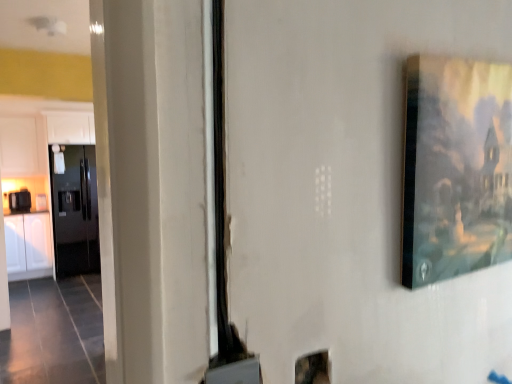
What do you see at coordinates (28, 246) in the screenshot? The image size is (512, 384). I see `white glossy cabinet at left, the 2th cabinetry from the top` at bounding box center [28, 246].

Locate an element on the screen. This screenshot has width=512, height=384. black glossy toaster at left is located at coordinates (20, 201).

What do you see at coordinates (75, 211) in the screenshot? I see `glossy black refrigerator at left` at bounding box center [75, 211].

Locate an element on the screen. This screenshot has width=512, height=384. white matte cabinet at upper left, acting as the second cabinetry starting from the bottom is located at coordinates (22, 145).

From the image's perspective, between matte wooden picture frame at upper right and white matte cabinet at upper left, which ranks as the 1th cabinetry in top-to-bottom order, which one is located above?

white matte cabinet at upper left, which ranks as the 1th cabinetry in top-to-bottom order.

Between matte wooden picture frame at upper right and white matte cabinet at upper left, which ranks as the 1th cabinetry in top-to-bottom order, which one has larger width?

white matte cabinet at upper left, which ranks as the 1th cabinetry in top-to-bottom order.

Is white matte cabinet at upper left, which ranks as the 1th cabinetry in top-to-bottom order, at the back of matte wooden picture frame at upper right?

Yes.

Is matte wooden picture frame at upper right not close to white matte cabinet at upper left, which ranks as the 1th cabinetry in top-to-bottom order?

matte wooden picture frame at upper right is far away from white matte cabinet at upper left, which ranks as the 1th cabinetry in top-to-bottom order.

In terms of height, does white matte cabinet at upper left, acting as the second cabinetry starting from the bottom, look taller or shorter compared to white glossy cabinet at left, the 2th cabinetry from the top?

Considering their sizes, white matte cabinet at upper left, acting as the second cabinetry starting from the bottom, has less height than white glossy cabinet at left, the 2th cabinetry from the top.

Is white matte cabinet at upper left, which ranks as the 1th cabinetry in top-to-bottom order, in front of white glossy cabinet at left, the 2th cabinetry from the top?

No, it is behind white glossy cabinet at left, the 2th cabinetry from the top.

Find the location of a particular element. Image resolution: width=512 pixels, height=384 pixels. cabinetry on the left of white glossy cabinet at left, the 1th cabinetry from the bottom is located at coordinates (22, 145).

Are white matte cabinet at upper left, which ranks as the 1th cabinetry in top-to-bottom order, and white glossy cabinet at left, the 1th cabinetry from the bottom, making contact?

No.

From the image's perspective, is black glossy toaster at left on top of matte wooden picture frame at upper right?

No, from the image's perspective, black glossy toaster at left is not above matte wooden picture frame at upper right.

Between black glossy toaster at left and matte wooden picture frame at upper right, which one has smaller size?

With smaller size is matte wooden picture frame at upper right.

Between black glossy toaster at left and matte wooden picture frame at upper right, which one appears on the left side from the viewer's perspective?

Positioned to the left is black glossy toaster at left.

How different are the orientations of black glossy toaster at left and matte wooden picture frame at upper right in degrees?

The angular difference between black glossy toaster at left and matte wooden picture frame at upper right is 4.31 degrees.

Is white glossy cabinet at left, the 1th cabinetry from the bottom, far away from matte wooden picture frame at upper right?

white glossy cabinet at left, the 1th cabinetry from the bottom, is positioned a significant distance from matte wooden picture frame at upper right.

Considering the relative positions of white glossy cabinet at left, the 2th cabinetry from the top, and matte wooden picture frame at upper right in the image provided, is white glossy cabinet at left, the 2th cabinetry from the top, to the left of matte wooden picture frame at upper right from the viewer's perspective?

Yes, white glossy cabinet at left, the 2th cabinetry from the top, is to the left of matte wooden picture frame at upper right.

Considering the positions of objects white glossy cabinet at left, the 2th cabinetry from the top, and matte wooden picture frame at upper right in the image provided, who is in front, white glossy cabinet at left, the 2th cabinetry from the top, or matte wooden picture frame at upper right?

matte wooden picture frame at upper right is in front.

Considering the points (35, 231) and (466, 123), which point is in front, point (35, 231) or point (466, 123)?

The point (466, 123) is in front.

Is black glossy toaster at left bigger or smaller than glossy black refrigerator at left?

Considering their sizes, black glossy toaster at left takes up less space than glossy black refrigerator at left.

Which object is positioned more to the right, black glossy toaster at left or glossy black refrigerator at left?

Positioned to the right is glossy black refrigerator at left.

Does point (20, 203) come in front of point (67, 241)?

No, it is not.

Which is in front, point (32, 220) or point (17, 210)?

Point (17, 210)

Would you say white glossy cabinet at left, the 2th cabinetry from the top, is outside black glossy toaster at left?

white glossy cabinet at left, the 2th cabinetry from the top, is positioned outside black glossy toaster at left.

Who is shorter, glossy black refrigerator at left or white glossy cabinet at left, the 2th cabinetry from the top?

With less height is white glossy cabinet at left, the 2th cabinetry from the top.

Consider the image. Would you say glossy black refrigerator at left is inside or outside white glossy cabinet at left, the 1th cabinetry from the bottom?

glossy black refrigerator at left lies outside white glossy cabinet at left, the 1th cabinetry from the bottom.

Could you tell me if glossy black refrigerator at left is turned towards white glossy cabinet at left, the 1th cabinetry from the bottom?

No, glossy black refrigerator at left is not oriented towards white glossy cabinet at left, the 1th cabinetry from the bottom.

The height and width of the screenshot is (384, 512). What are the coordinates of `cabinetry positioned vertically above the matte wooden picture frame at upper right (from a real-world perspective)` in the screenshot? It's located at (22, 145).

Locate an element on the screen. This screenshot has width=512, height=384. cabinetry located in front of the white matte cabinet at upper left, which ranks as the 1th cabinetry in top-to-bottom order is located at coordinates (28, 246).

Estimate the real-world distances between objects in this image. Which object is closer to white matte cabinet at upper left, which ranks as the 1th cabinetry in top-to-bottom order, black glossy toaster at left or white glossy cabinet at left, the 1th cabinetry from the bottom?

The object closer to white matte cabinet at upper left, which ranks as the 1th cabinetry in top-to-bottom order, is black glossy toaster at left.

Considering their positions, is white glossy cabinet at left, the 1th cabinetry from the bottom, positioned further to matte wooden picture frame at upper right than white matte cabinet at upper left, acting as the second cabinetry starting from the bottom?

Based on the image, white glossy cabinet at left, the 1th cabinetry from the bottom, appears to be further to matte wooden picture frame at upper right.

Based on their spatial positions, is white glossy cabinet at left, the 2th cabinetry from the top, or white matte cabinet at upper left, acting as the second cabinetry starting from the bottom, further from glossy black refrigerator at left?

white matte cabinet at upper left, acting as the second cabinetry starting from the bottom, lies further to glossy black refrigerator at left than the other object.

Considering their positions, is black glossy toaster at left positioned closer to white glossy cabinet at left, the 2th cabinetry from the top, than white matte cabinet at upper left, acting as the second cabinetry starting from the bottom?

black glossy toaster at left.

Which object lies nearer to the anchor point matte wooden picture frame at upper right, white matte cabinet at upper left, which ranks as the 1th cabinetry in top-to-bottom order, or black glossy toaster at left?

The object closer to matte wooden picture frame at upper right is white matte cabinet at upper left, which ranks as the 1th cabinetry in top-to-bottom order.

When comparing their distances from glossy black refrigerator at left, does white glossy cabinet at left, the 2th cabinetry from the top, or black glossy toaster at left seem further?

Based on the image, black glossy toaster at left appears to be further to glossy black refrigerator at left.

From the image, which object appears to be farther from white matte cabinet at upper left, which ranks as the 1th cabinetry in top-to-bottom order, matte wooden picture frame at upper right or glossy black refrigerator at left?

matte wooden picture frame at upper right is positioned further to the anchor white matte cabinet at upper left, which ranks as the 1th cabinetry in top-to-bottom order.

From the picture: Looking at the image, which one is located further to black glossy toaster at left, white glossy cabinet at left, the 2th cabinetry from the top, or glossy black refrigerator at left?

Based on the image, glossy black refrigerator at left appears to be further to black glossy toaster at left.

You are a GUI agent. You are given a task and a screenshot of the screen. Output one action in this format:
    pyautogui.click(x=<x>, y=<y>)
    Task: Click on the door between white matte cabinet at upper left, acting as the second cabinetry starting from the bottom, and white glossy cabinet at left, the 2th cabinetry from the top, in the vertical direction
    This screenshot has height=384, width=512.
    Given the screenshot: What is the action you would take?
    pyautogui.click(x=75, y=211)

This screenshot has height=384, width=512. I want to click on appliance between white matte cabinet at upper left, which ranks as the 1th cabinetry in top-to-bottom order, and glossy black refrigerator at left in the up-down direction, so click(20, 201).

Image resolution: width=512 pixels, height=384 pixels. In order to click on cabinetry between matte wooden picture frame at upper right and white matte cabinet at upper left, which ranks as the 1th cabinetry in top-to-bottom order, in the front-back direction in this screenshot , I will do `click(28, 246)`.

You are a GUI agent. You are given a task and a screenshot of the screen. Output one action in this format:
    pyautogui.click(x=<x>, y=<y>)
    Task: Click on the appliance between white matte cabinet at upper left, which ranks as the 1th cabinetry in top-to-bottom order, and white glossy cabinet at left, the 1th cabinetry from the bottom, from top to bottom
    The image size is (512, 384).
    Given the screenshot: What is the action you would take?
    point(20,201)